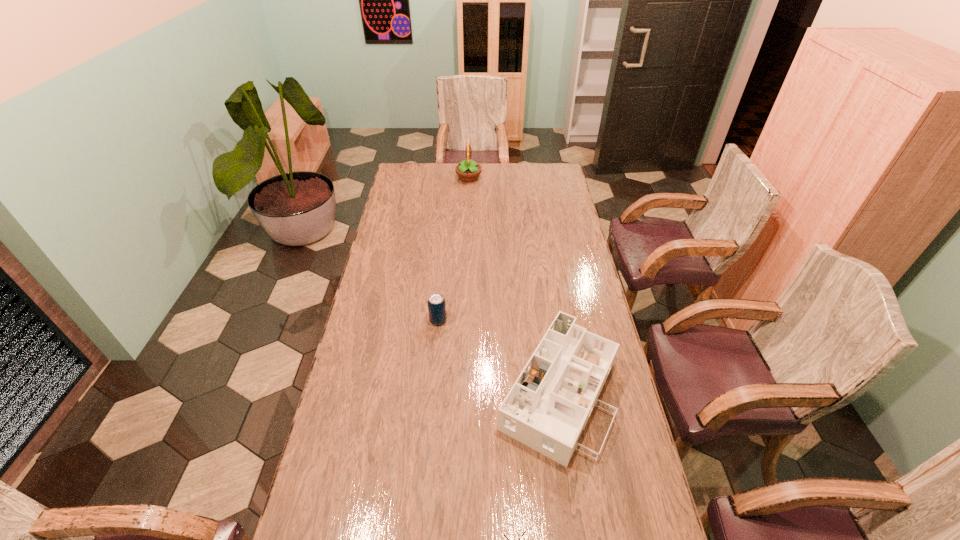
The height and width of the screenshot is (540, 960). What are the coordinates of `unoccupied area between the second farthest object and the tallest object` in the screenshot? It's located at (453, 249).

Select which object appears as the closest to the third farthest object. Please provide its 2D coordinates. Your answer should be formatted as a tuple, i.e. [(x, y)], where the tuple contains the x and y coordinates of a point satisfying the conditions above.

[(525, 531)]

Find the location of a particular element. The image size is (960, 540). object that stands as the second closest to the dollhouse is located at coordinates (436, 303).

What are the coordinates of `vacant area in the image that satisfies the following two spatial constraints: 1. on the face of the second nearest object; 2. on the left side of the tallest object` in the screenshot? It's located at (461, 391).